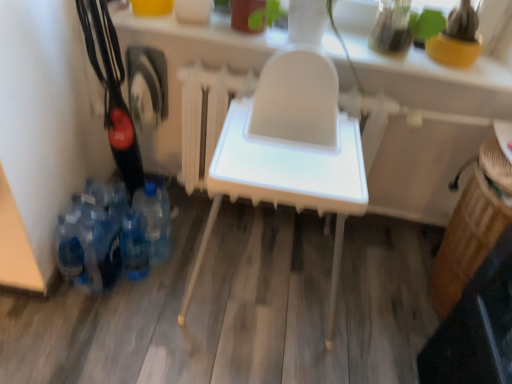
You are a GUI agent. You are given a task and a screenshot of the screen. Output one action in this format:
    pyautogui.click(x=<x>, y=<y>)
    Task: Click on the vacant space to the left of white plastic high chair at center
    The image size is (512, 384).
    Given the screenshot: What is the action you would take?
    pyautogui.click(x=132, y=304)